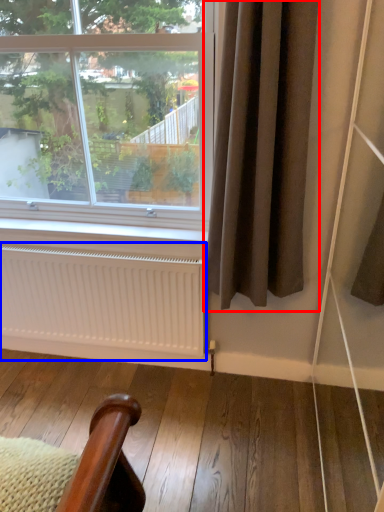
Question: Among these objects, which one is nearest to the camera, curtain (highlighted by a red box) or radiator (highlighted by a blue box)?

Choices:
 (A) curtain
 (B) radiator

Answer: (A)